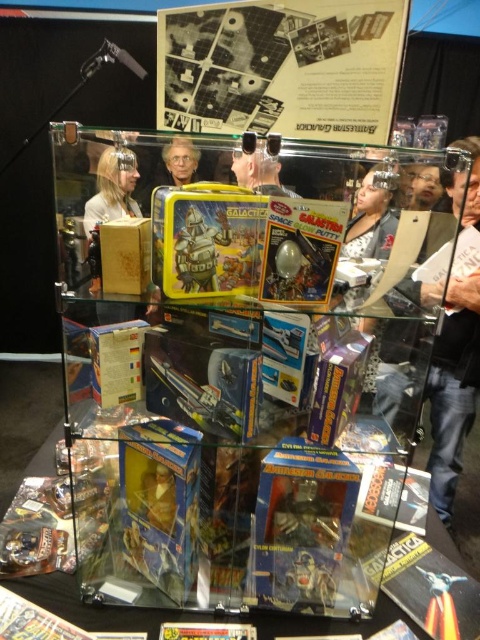
Is gold cardboard box at center behind metallic yellow lunchbox at center?

Yes, it is.

Does gold cardboard box at center appear on the left side of metallic yellow lunchbox at center?

Yes, gold cardboard box at center is to the left of metallic yellow lunchbox at center.

Does point (132, 253) lie behind point (193, 241)?

Yes, it is behind point (193, 241).

Find the location of a particular element. gold cardboard box at center is located at coordinates (124, 256).

Which is more to the left, transparent plastic glass box at center or gold cardboard box at center?

gold cardboard box at center is more to the left.

Does transparent plastic glass box at center appear under gold cardboard box at center?

Actually, transparent plastic glass box at center is above gold cardboard box at center.

Find the location of `transparent plastic glass box at center`. transparent plastic glass box at center is located at coordinates (242, 376).

Who is lower down, gold cardboard box at center or metallic orange toy at lower right?

metallic orange toy at lower right is below.

Who is shorter, gold cardboard box at center or metallic orange toy at lower right?

Standing shorter between the two is metallic orange toy at lower right.

Is point (139, 244) less distant than point (439, 632)?

Yes, point (139, 244) is closer to viewer.

Identify the location of gold cardboard box at center. This screenshot has height=640, width=480. (124, 256).